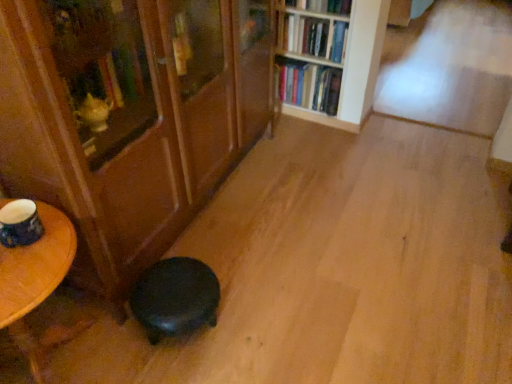
Question: From the image's perspective, is hardcover books at upper center, which ranks as the second book in bottom-to-top order, located above or below hardcover book at upper center, marked as the 1th book in a top-to-bottom arrangement?

Choices:
 (A) above
 (B) below

Answer: (B)

Question: Is hardcover books at upper center, which ranks as the second book in top-to-bottom order, spatially inside hardcover book at upper center, which is counted as the third book, starting from the bottom, or outside of it?

Choices:
 (A) outside
 (B) inside

Answer: (A)

Question: Estimate the real-world distances between objects in this image. Which object is farther from the wooden round table at lower left?

Choices:
 (A) hardcover book at upper center, which is counted as the third book, starting from the bottom
 (B) hardcover books at upper center, which ranks as the second book in top-to-bottom order
 (C) hardcover books at upper center, the third book viewed from the top
 (D) matte wood bookcase at lower left, marked as the 1th bookcase in a left-to-right arrangement
 (E) black matte stool at lower left

Answer: (A)

Question: Which is farther from the black matte stool at lower left?

Choices:
 (A) hardcover books at upper center, the third book viewed from the top
 (B) matte wood bookcase at lower left, marked as the 1th bookcase in a left-to-right arrangement
 (C) hardcover books at upper center, which ranks as the second book in top-to-bottom order
 (D) wooden round table at lower left
 (E) hardcover book at upper center, which is counted as the third book, starting from the bottom

Answer: (E)